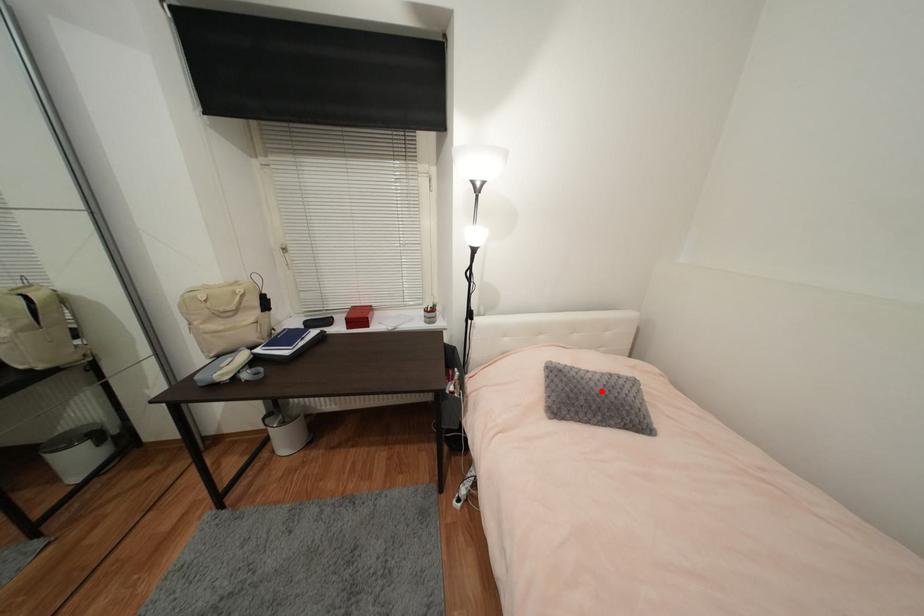
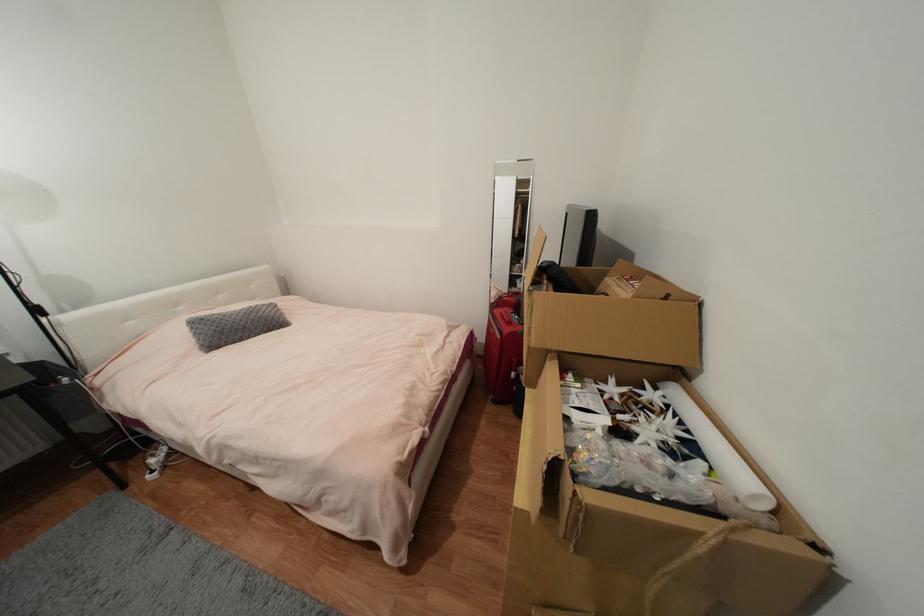
In the second image, find the point that corresponds to the highlighted location in the first image.

(244, 320)